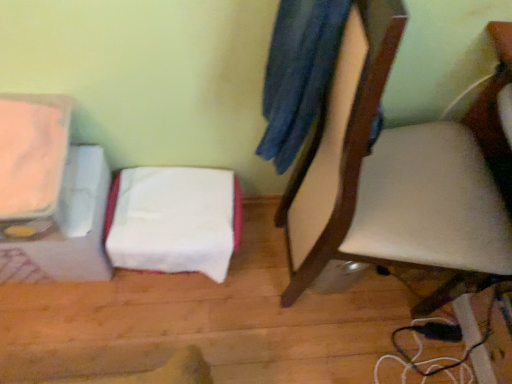
Question: Considering their positions, is white leather chair at center located in front of or behind matte orange toaster at left?

Choices:
 (A) behind
 (B) front

Answer: (B)

Question: From the image's perspective, is white leather chair at center located above or below matte orange toaster at left?

Choices:
 (A) below
 (B) above

Answer: (A)

Question: Which is farther from the white fabric at lower left?

Choices:
 (A) matte orange toaster at left
 (B) white leather chair at center

Answer: (B)

Question: Estimate the real-world distances between objects in this image. Which object is farther from the white fabric at lower left?

Choices:
 (A) white leather chair at center
 (B) matte orange toaster at left

Answer: (A)